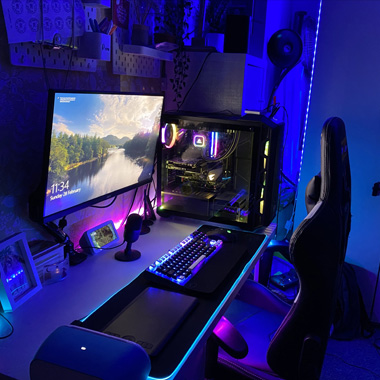
At what (x,y) coordinates should I click in order to perform the action: click on fan. Please return your answer as a coordinate pair (x, y). The height and width of the screenshot is (380, 380). Looking at the image, I should click on (288, 39).